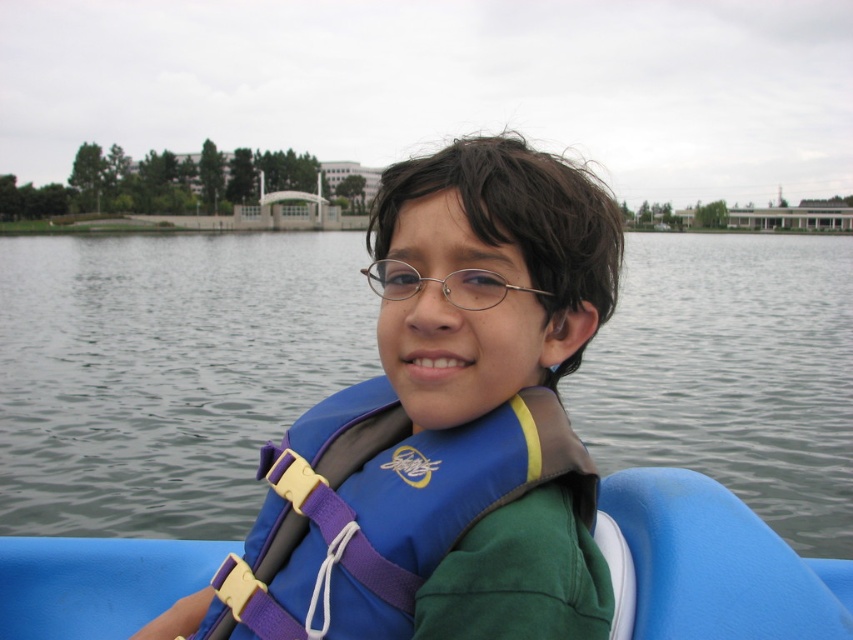
Question: Which point is farther to the camera?

Choices:
 (A) blue plastic boat at center
 (B) blue fabric life vest at center
 (C) blue fabric life jacket at center
 (D) gray water at center

Answer: (D)

Question: Among these points, which one is farthest from the camera?

Choices:
 (A) (514, 305)
 (B) (508, 289)
 (C) (263, 397)
 (D) (405, 528)

Answer: (C)

Question: Considering the real-world distances, which object is farthest from the blue fabric life vest at center?

Choices:
 (A) gray water at center
 (B) metallic oval glasses at center

Answer: (A)

Question: Does blue fabric life jacket at center appear on the right side of metallic oval glasses at center?

Choices:
 (A) no
 (B) yes

Answer: (A)

Question: From the image, what is the correct spatial relationship of blue fabric life jacket at center in relation to blue plastic boat at center?

Choices:
 (A) above
 (B) below

Answer: (A)

Question: Can you confirm if blue fabric life jacket at center is positioned below metallic oval glasses at center?

Choices:
 (A) yes
 (B) no

Answer: (A)